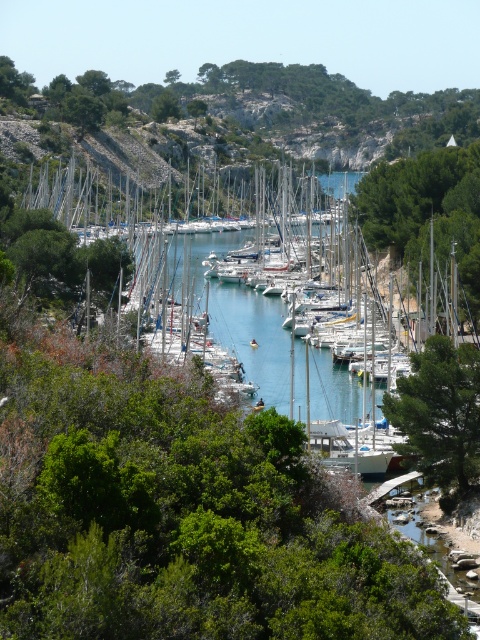
You are a bird looking for a nesting spot. You see the green leafy tree at right and the green leafy tree at center. Which tree would you choose if you want to build a nest higher up?

The green leafy tree at right is much taller than the green leafy tree at center, so you should choose the green leafy tree at right to build a nest higher up.

You are standing at the point labeled point (455, 412) and want to walk to point (180, 113). Based on the scene, which direction should you move to get closer to your destination?

Since point (455, 412) is closer to the camera than point (180, 113), you should move away from the camera to reach your destination.

You are standing at the edge of the marina and want to take a photo of the green leafy tree at center. If your camera has a maximum zoom range of 200 feet, can you capture the entire tree in the photo without moving closer?

The green leafy tree at center is 195.52 feet away from the camera. Since the camera can zoom up to 200 feet, you can capture the entire tree in the photo without moving closer.